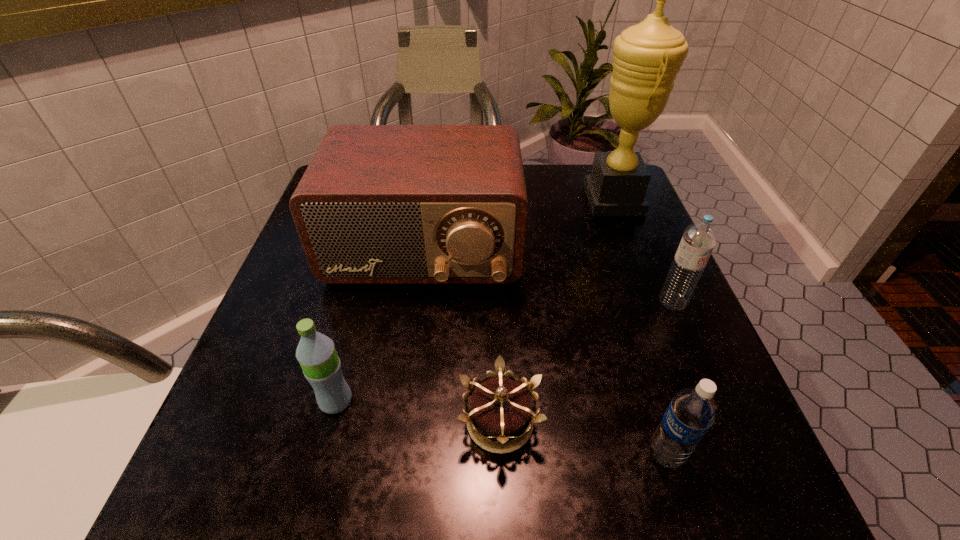
You are a GUI agent. You are given a task and a screenshot of the screen. Output one action in this format:
    pyautogui.click(x=<x>, y=<y>)
    Task: Click on the vacant position in the image that satisfies the following two spatial constraints: 1. on the front panel of the radio receiver; 2. on the right side of the farthest water bottle
    
    Given the screenshot: What is the action you would take?
    pyautogui.click(x=418, y=301)